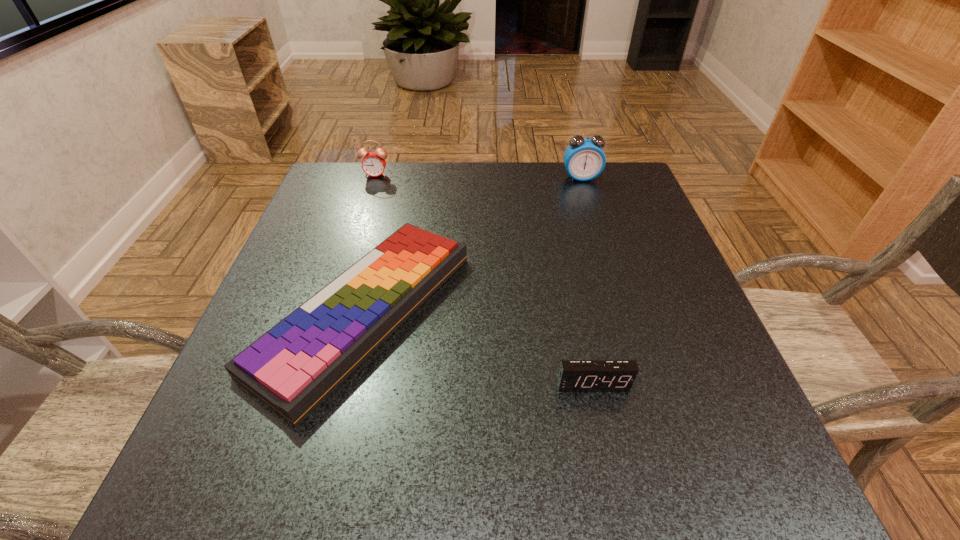
At what (x,y) coordinates should I click in order to perform the action: click on computer keyboard that is at the left edge. Please return your answer as a coordinate pair (x, y). Looking at the image, I should click on (293, 367).

Where is `object present at the right edge`? The image size is (960, 540). object present at the right edge is located at coordinates (584, 159).

The height and width of the screenshot is (540, 960). I want to click on object present at the far left corner, so click(x=373, y=164).

Image resolution: width=960 pixels, height=540 pixels. Identify the location of object that is at the far right corner. (584, 159).

Find the location of `free location at the far edge of the desktop`. free location at the far edge of the desktop is located at coordinates (435, 208).

In the image, there is a desktop. Identify the location of free space at the near edge. Image resolution: width=960 pixels, height=540 pixels. (500, 459).

This screenshot has height=540, width=960. Find the location of `vacant space at the left edge`. vacant space at the left edge is located at coordinates (283, 279).

This screenshot has height=540, width=960. I want to click on free space at the right edge of the desktop, so click(708, 409).

The image size is (960, 540). Identify the location of vacant space at the far left corner. (352, 185).

In the image, there is a desktop. Where is `vacant space at the far right corner`? vacant space at the far right corner is located at coordinates tap(588, 197).